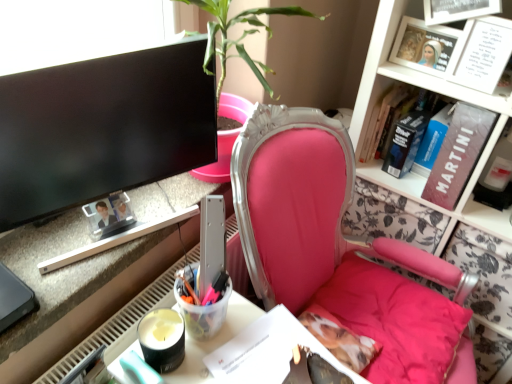
Measure the distance between blue hardcover book at upper right, acting as the third book starting from the front, and camera.

A distance of 4.16 feet exists between blue hardcover book at upper right, acting as the third book starting from the front, and camera.

What is the approximate width of white paper at upper right, arranged as the first book when viewed from the front?

It is 2.27 inches.

Describe the element at coordinates (484, 53) in the screenshot. I see `white paper at upper right, arranged as the first book when viewed from the front` at that location.

What is the approximate width of black glossy monitor at upper left?

It is 10.01 centimeters.

Looking at this image, how much space does hardcover book at upper right, placed as the 2th book when sorted from back to front, occupy vertically?

It is 7.54 inches.

Where is `pink fabric chair at center`? The image size is (512, 384). pink fabric chair at center is located at coordinates (340, 250).

Considering the relative sizes of hardcover book at upper right, placed as the 2th book when sorted from back to front, and maroon matte book at upper right, which ranks as the fourth book in back-to-front order, in the image provided, is hardcover book at upper right, placed as the 2th book when sorted from back to front, taller than maroon matte book at upper right, which ranks as the fourth book in back-to-front order,?

Incorrect, the height of hardcover book at upper right, placed as the 2th book when sorted from back to front, is not larger of that of maroon matte book at upper right, which ranks as the fourth book in back-to-front order.

Is hardcover book at upper right, placed as the 2th book when sorted from back to front, in front of or behind maroon matte book at upper right, the 2th book positioned from the front, in the image?

Visually, hardcover book at upper right, placed as the 2th book when sorted from back to front, is located behind maroon matte book at upper right, the 2th book positioned from the front.

Which is farther from the camera, (x=433, y=145) or (x=433, y=174)?

The point (x=433, y=145) is farther.

Where is `the 3rd book below the maroon matte book at upper right, which ranks as the fourth book in back-to-front order (from a real-world perspective)`? This screenshot has width=512, height=384. the 3rd book below the maroon matte book at upper right, which ranks as the fourth book in back-to-front order (from a real-world perspective) is located at coordinates (409, 135).

Identify the location of computer monitor below the white paper at upper right, arranged as the first book when viewed from the front (from a real-world perspective). The image size is (512, 384). click(102, 128).

In terms of size, does black glossy monitor at upper left appear bigger or smaller than white paper at upper right, acting as the fifth book starting from the back?

black glossy monitor at upper left is bigger than white paper at upper right, acting as the fifth book starting from the back.

From the image's perspective, who appears lower, black glossy monitor at upper left or white paper at upper right, arranged as the first book when viewed from the front?

black glossy monitor at upper left, from the image's perspective.

Can you confirm if black glossy monitor at upper left is thinner than white paper at upper right, acting as the fifth book starting from the back?

No.

From the image's perspective, is blue hardcover book at upper right, acting as the third book starting from the front, above or below metallic silver desk at lower left?

Based on their image positions, blue hardcover book at upper right, acting as the third book starting from the front, is located above metallic silver desk at lower left.

Which object is closer to the camera taking this photo, blue hardcover book at upper right, acting as the third book starting from the front, or metallic silver desk at lower left?

Positioned in front is metallic silver desk at lower left.

Considering the positions of objects blue hardcover book at upper right, acting as the third book starting from the front, and metallic silver desk at lower left in the image provided, who is more to the left, blue hardcover book at upper right, acting as the third book starting from the front, or metallic silver desk at lower left?

metallic silver desk at lower left is more to the left.

Is blue hardcover book at upper right, which is the 3th book in back-to-front order, far from metallic silver desk at lower left?

Actually, blue hardcover book at upper right, which is the 3th book in back-to-front order, and metallic silver desk at lower left are a little close together.

This screenshot has width=512, height=384. Identify the location of the 4th book located beneath the white paper at upper right, acting as the fifth book starting from the back (from a real-world perspective). (409, 135).

How different are the orientations of hardcover book at upper right, placed as the 2th book when sorted from back to front, and white paper at upper right, arranged as the first book when viewed from the front, in degrees?

They differ by 2.21 degrees in their facing directions.

Consider the image. From their relative heights in the image, would you say hardcover book at upper right, which ranks as the 4th book in front-to-back order, is taller or shorter than white paper at upper right, arranged as the first book when viewed from the front?

In the image, hardcover book at upper right, which ranks as the 4th book in front-to-back order, appears to be taller than white paper at upper right, arranged as the first book when viewed from the front.

Is hardcover book at upper right, which ranks as the 4th book in front-to-back order, inside or outside of white paper at upper right, arranged as the first book when viewed from the front?

The correct answer is: outside.

From a real-world perspective, is maroon matte book at upper right, which ranks as the fourth book in back-to-front order, under hardcover book at upper right, which ranks as the 4th book in front-to-back order?

No, from a real-world perspective, maroon matte book at upper right, which ranks as the fourth book in back-to-front order, is not below hardcover book at upper right, which ranks as the 4th book in front-to-back order.

Is maroon matte book at upper right, which ranks as the fourth book in back-to-front order, at the right side of hardcover book at upper right, which ranks as the 4th book in front-to-back order?

Correct, you'll find maroon matte book at upper right, which ranks as the fourth book in back-to-front order, to the right of hardcover book at upper right, which ranks as the 4th book in front-to-back order.

Is maroon matte book at upper right, the 2th book positioned from the front, beside hardcover book at upper right, which ranks as the 4th book in front-to-back order?

There is a gap between maroon matte book at upper right, the 2th book positioned from the front, and hardcover book at upper right, which ranks as the 4th book in front-to-back order.

Consider the image. Is white paper at upper right, acting as the fifth book starting from the back, with hardcover book at upper right, which is the 1th book from back to front?

No.

How different are the orientations of white paper at upper right, acting as the fifth book starting from the back, and hardcover book at upper right, acting as the 5th book starting from the front, in degrees?

white paper at upper right, acting as the fifth book starting from the back, and hardcover book at upper right, acting as the 5th book starting from the front, are facing 2.21 degrees away from each other.

Which is more to the left, white paper at upper right, arranged as the first book when viewed from the front, or hardcover book at upper right, which is the 1th book from back to front?

hardcover book at upper right, which is the 1th book from back to front.

From the image's perspective, is white paper at upper right, arranged as the first book when viewed from the front, on hardcover book at upper right, which is the 1th book from back to front?

Yes, from the image's perspective, white paper at upper right, arranged as the first book when viewed from the front, is over hardcover book at upper right, which is the 1th book from back to front.

What are the coordinates of `chair located in front of the black glossy monitor at upper left` in the screenshot? It's located at (340, 250).

From a real-world perspective, relative to pink fabric chair at center, is black glossy monitor at upper left vertically above or below?

Clearly, from a real-world perspective, black glossy monitor at upper left is above pink fabric chair at center.

Considering the sizes of black glossy monitor at upper left and pink fabric chair at center in the image, is black glossy monitor at upper left wider or thinner than pink fabric chair at center?

In the image, black glossy monitor at upper left appears to be more narrow than pink fabric chair at center.

Considering their positions, is black glossy monitor at upper left located in front of or behind pink fabric chair at center?

black glossy monitor at upper left is behind pink fabric chair at center.

Find the location of a particular element. This screenshot has width=512, height=384. the 2nd book positioned above the maroon matte book at upper right, the 2th book positioned from the front (from the image's perspective) is located at coordinates (409, 135).

Identify the location of the 1st book behind when counting from the black glossy monitor at upper left. This screenshot has height=384, width=512. (484, 53).

Which object lies nearer to the anchor point white paper at upper right, arranged as the first book when viewed from the front, metallic silver desk at lower left or blue hardcover book at upper right, acting as the third book starting from the front?

blue hardcover book at upper right, acting as the third book starting from the front.

Looking at this image, which object lies further to the anchor point maroon matte book at upper right, which ranks as the fourth book in back-to-front order, pink fabric chair at center or white paper at upper right, acting as the fifth book starting from the back?

The object further to maroon matte book at upper right, which ranks as the fourth book in back-to-front order, is pink fabric chair at center.

When comparing their distances from blue hardcover book at upper right, which is the 3th book in back-to-front order, does hardcover book at upper right, which is the 1th book from back to front, or hardcover book at upper right, which ranks as the 4th book in front-to-back order, seem further?

hardcover book at upper right, which is the 1th book from back to front, is positioned further to the anchor blue hardcover book at upper right, which is the 3th book in back-to-front order.

When comparing their distances from black glossy monitor at upper left, does hardcover book at upper right, which is the 1th book from back to front, or blue hardcover book at upper right, which is the 3th book in back-to-front order, seem further?

Among the two, blue hardcover book at upper right, which is the 3th book in back-to-front order, is located further to black glossy monitor at upper left.

Which object lies further to the anchor point metallic silver desk at lower left, translucent plastic cup at lower center or black glossy monitor at upper left?

Based on the image, translucent plastic cup at lower center appears to be further to metallic silver desk at lower left.

Estimate the real-world distances between objects in this image. Which object is further from white paper at upper right, acting as the fifth book starting from the back, hardcover book at upper right, which is the 1th book from back to front, or metallic silver desk at lower left?

metallic silver desk at lower left is positioned further to the anchor white paper at upper right, acting as the fifth book starting from the back.

Which object lies further to the anchor point black glossy monitor at upper left, maroon matte book at upper right, the 2th book positioned from the front, or metallic silver desk at lower left?

Based on the image, maroon matte book at upper right, the 2th book positioned from the front, appears to be further to black glossy monitor at upper left.

Based on their spatial positions, is black glossy monitor at upper left or pink fabric chair at center closer to hardcover book at upper right, placed as the 2th book when sorted from back to front?

Based on the image, pink fabric chair at center appears to be nearer to hardcover book at upper right, placed as the 2th book when sorted from back to front.

Where is `stationery between metallic silver desk at lower left and maroon matte book at upper right, the 2th book positioned from the front, from left to right`? The image size is (512, 384). stationery between metallic silver desk at lower left and maroon matte book at upper right, the 2th book positioned from the front, from left to right is located at coordinates (162, 339).

This screenshot has height=384, width=512. I want to click on chair between black glossy monitor at upper left and hardcover book at upper right, acting as the 5th book starting from the front, so click(x=340, y=250).

Identify the location of computer monitor located between metallic silver desk at lower left and white paper at upper right, arranged as the first book when viewed from the front, in the left-right direction. (102, 128).

Find the location of a particular element. stationery between black glossy monitor at upper left and pink fabric chair at center in the horizontal direction is located at coordinates (162, 339).